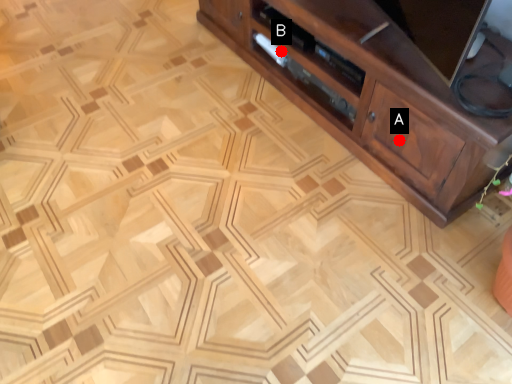
Question: Two points are circled on the image, labeled by A and B beside each circle. Which point is closer to the camera taking this photo?

Choices:
 (A) A is closer
 (B) B is closer

Answer: (A)